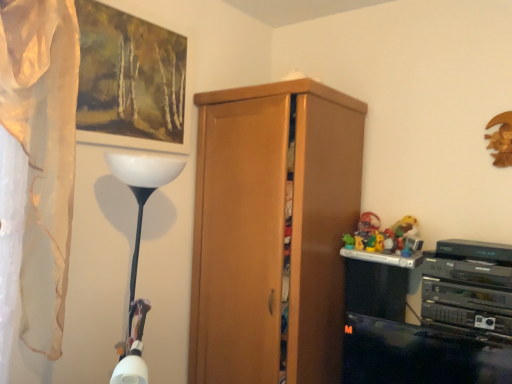
Question: Is wooden picture frame at upper left oriented away from white sheer curtain at left?

Choices:
 (A) no
 (B) yes

Answer: (A)

Question: Is wooden picture frame at upper left taller than white sheer curtain at left?

Choices:
 (A) yes
 (B) no

Answer: (B)

Question: Does wooden picture frame at upper left have a lesser width compared to white sheer curtain at left?

Choices:
 (A) yes
 (B) no

Answer: (A)

Question: Is wooden picture frame at upper left not inside white sheer curtain at left?

Choices:
 (A) yes
 (B) no

Answer: (A)

Question: Considering the relative positions of wooden picture frame at upper left and white sheer curtain at left in the image provided, is wooden picture frame at upper left to the left of white sheer curtain at left from the viewer's perspective?

Choices:
 (A) no
 (B) yes

Answer: (A)

Question: Based on their positions, is wooden picture frame at upper left located to the left or right of white sheer curtain at left?

Choices:
 (A) left
 (B) right

Answer: (B)

Question: From the image's perspective, is wooden picture frame at upper left located above or below white sheer curtain at left?

Choices:
 (A) below
 (B) above

Answer: (B)

Question: In terms of width, does wooden picture frame at upper left look wider or thinner when compared to white sheer curtain at left?

Choices:
 (A) thin
 (B) wide

Answer: (A)

Question: From a real-world perspective, is wooden picture frame at upper left positioned above or below white sheer curtain at left?

Choices:
 (A) below
 (B) above

Answer: (B)

Question: Considering their positions, is white sheer curtain at left located in front of or behind wooden cabinet at center?

Choices:
 (A) front
 (B) behind

Answer: (A)

Question: Does point (70, 26) appear closer or farther from the camera than point (241, 137)?

Choices:
 (A) farther
 (B) closer

Answer: (B)

Question: From their relative heights in the image, would you say white sheer curtain at left is taller or shorter than wooden cabinet at center?

Choices:
 (A) short
 (B) tall

Answer: (A)

Question: From the image's perspective, relative to wooden cabinet at center, is white sheer curtain at left above or below?

Choices:
 (A) above
 (B) below

Answer: (A)

Question: Do you think wooden cabinet at center is within white sheer curtain at left, or outside of it?

Choices:
 (A) outside
 (B) inside

Answer: (A)

Question: Based on their positions, is wooden cabinet at center located to the left or right of white sheer curtain at left?

Choices:
 (A) left
 (B) right

Answer: (B)